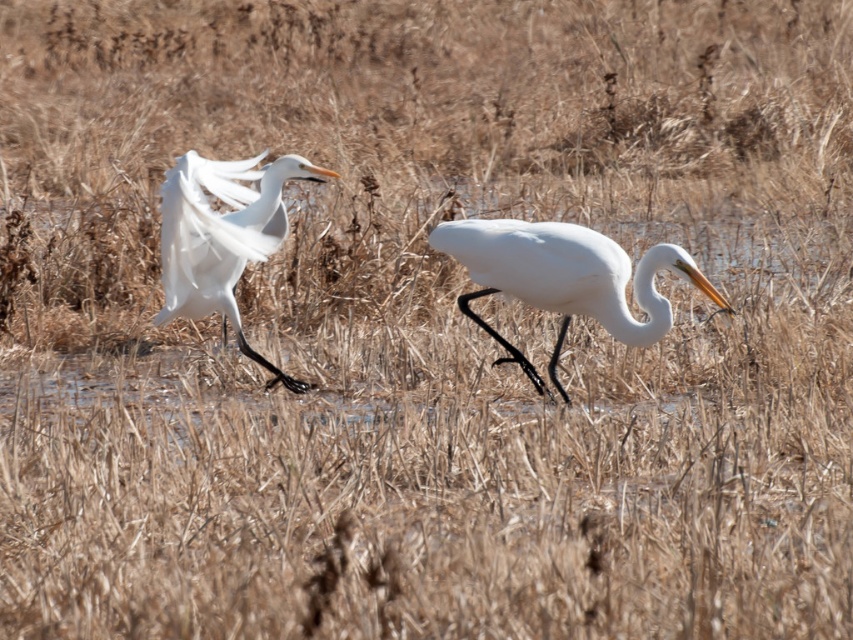
Consider the image. Who is taller, white smooth heron at center or white feathered bird at center?

Standing taller between the two is white feathered bird at center.

Does white smooth heron at center have a greater height compared to white feathered bird at center?

No, white smooth heron at center is not taller than white feathered bird at center.

Is point (505, 252) positioned after point (202, 307)?

No, (505, 252) is closer to viewer.

Locate an element on the screen. white smooth heron at center is located at coordinates pos(564,278).